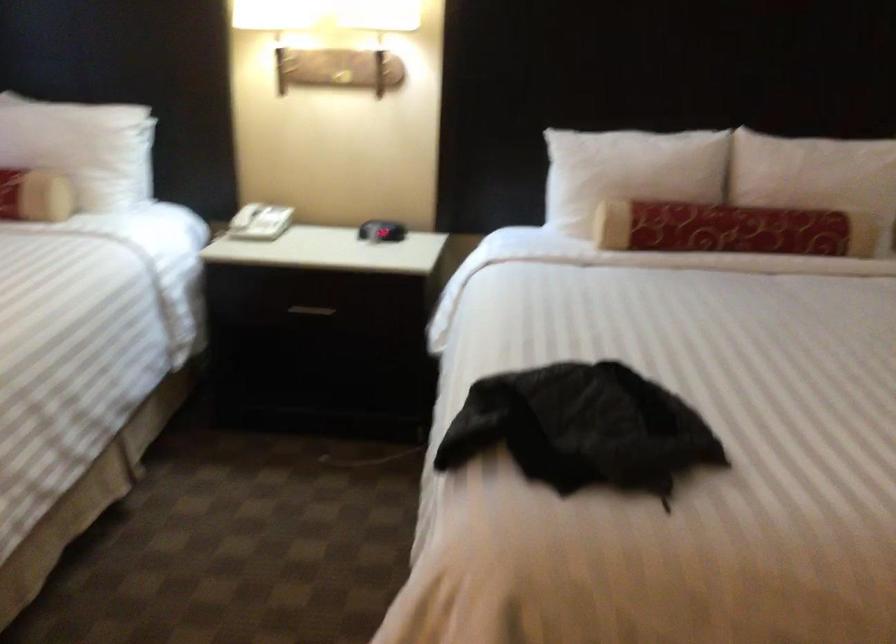
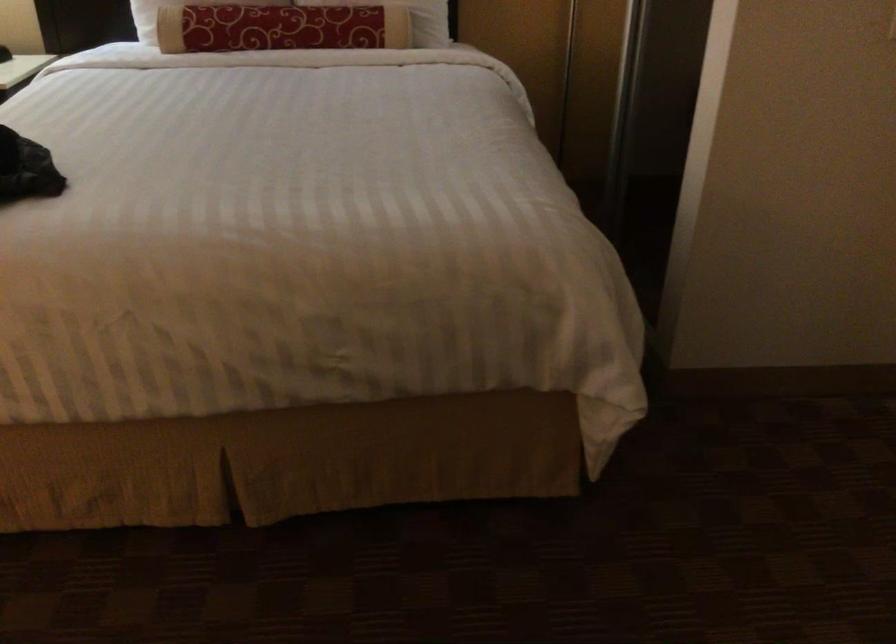
In the second image, find the point that corresponds to [776,212] in the first image.

(311, 15)